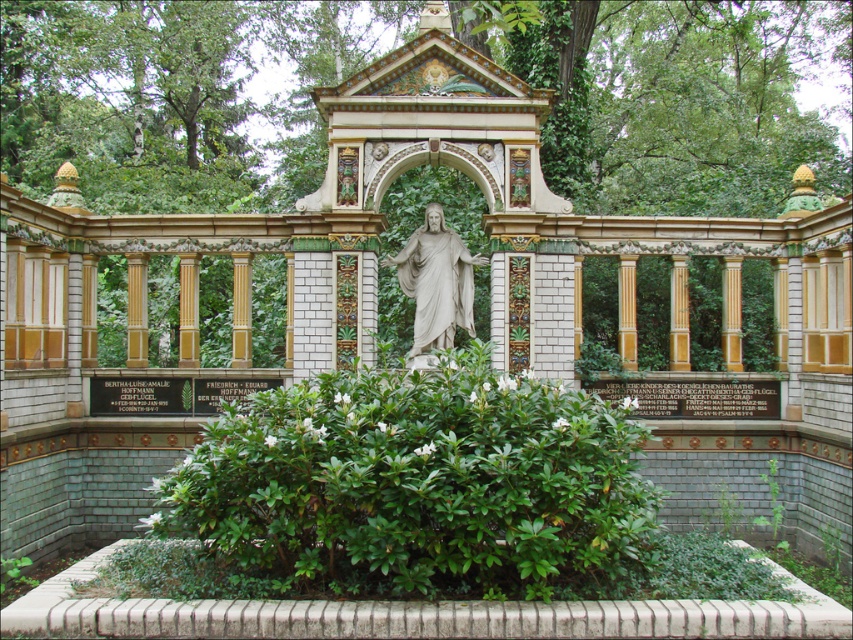
You are a visitor at the mausoleum and want to take a photo of both the green leafy bush at center and the white marble statue at center. Since you want both to be fully visible in the frame, which object should you focus on to ensure they are both in the shot?

You should focus on the white marble statue at center because it is smaller than the green leafy bush at center, so by ensuring the statue is centered, the larger bush will also fit into the frame.

You are standing in front of the mausoleum and want to place a small flower pot exactly at the center of the mausoleum. The statue of Jesus Christ is already there. Where should you place the flower pot relative to the green leafy bush at center?

The flower pot should be placed at the same position as the green leafy bush at center, which is at point (415, 490).

You are a visitor at the mausoleum and want to take a photo of the white marble statue at center without any obstruction. However, there is a green leafy bush at center in the way. Can you suggest a position where you can stand to capture the statue clearly?

The green leafy bush at center is much taller than the white marble statue at center, so you should stand behind the bush to ensure the statue is visible above the bush.